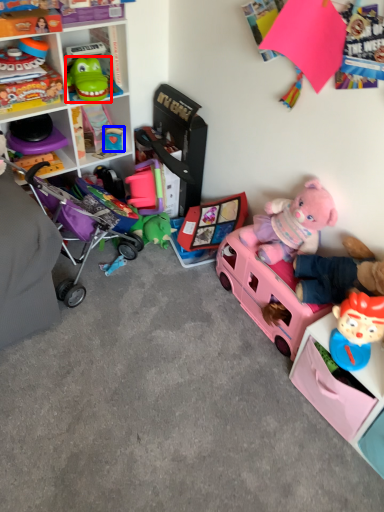
Question: Which of the following is the closest to the observer, toy (highlighted by a red box) or toy (highlighted by a blue box)?

Choices:
 (A) toy
 (B) toy

Answer: (A)